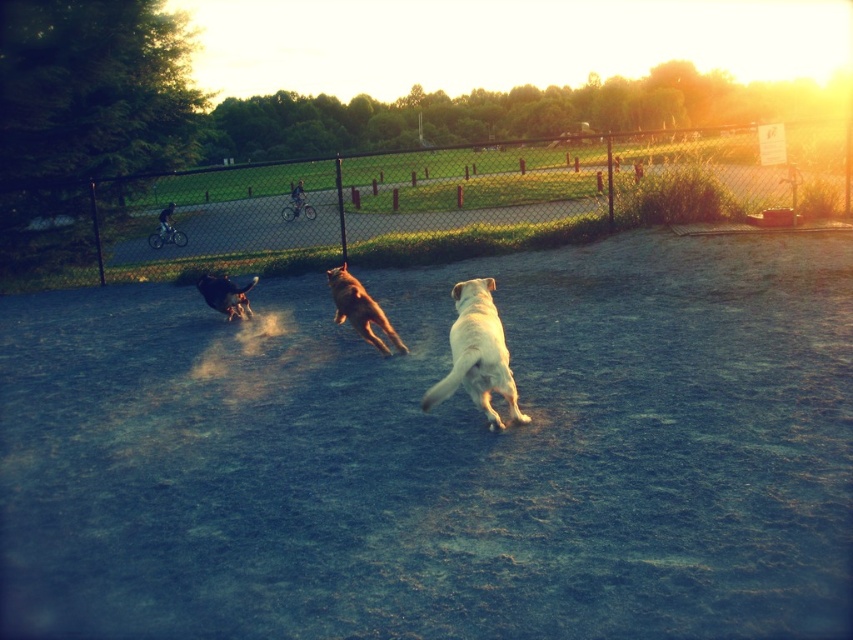
Which of these two, black chain-link fence at upper center or black fur dog at left, stands taller?

Standing taller between the two is black chain-link fence at upper center.

Does black chain-link fence at upper center appear on the left side of black fur dog at left?

In fact, black chain-link fence at upper center is to the right of black fur dog at left.

Who is more distant from viewer, (74,204) or (196,282)?

Positioned behind is point (74,204).

You are a GUI agent. You are given a task and a screenshot of the screen. Output one action in this format:
    pyautogui.click(x=<x>, y=<y>)
    Task: Click on the black chain-link fence at upper center
    This screenshot has height=640, width=853.
    Given the screenshot: What is the action you would take?
    pos(421,204)

Is black chain-link fence at upper center taller than golden fur dog at center?

Yes.

Identify the location of black chain-link fence at upper center. The width and height of the screenshot is (853, 640). (421, 204).

What do you see at coordinates (421, 204) in the screenshot? The height and width of the screenshot is (640, 853). I see `black chain-link fence at upper center` at bounding box center [421, 204].

Identify the location of black chain-link fence at upper center. (421, 204).

Does light yellow fur at center appear on the left side of golden fur dog at center?

No, light yellow fur at center is not to the left of golden fur dog at center.

Is point (451, 332) less distant than point (335, 314)?

Yes, it is in front of point (335, 314).

This screenshot has width=853, height=640. What are the coordinates of `light yellow fur at center` in the screenshot? It's located at (477, 355).